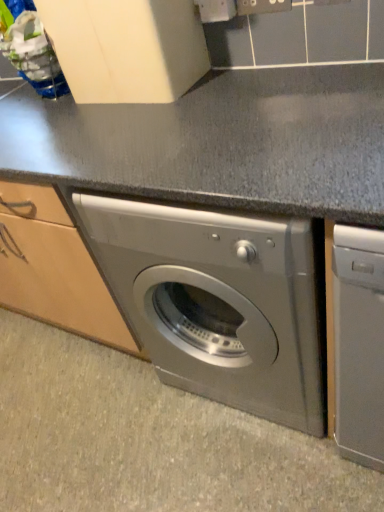
Describe the element at coordinates (220, 302) in the screenshot. I see `satin silver washing machine at center` at that location.

The height and width of the screenshot is (512, 384). I want to click on satin silver washing machine at center, so click(220, 302).

Find the location of `slate gray granite at center`. slate gray granite at center is located at coordinates (147, 439).

What do you see at coordinates (147, 439) in the screenshot?
I see `slate gray granite at center` at bounding box center [147, 439].

The width and height of the screenshot is (384, 512). What are the coordinates of `satin silver washing machine at center` in the screenshot? It's located at (220, 302).

Considering the positions of objects satin silver washing machine at center and slate gray granite at center in the image provided, who is more to the left, satin silver washing machine at center or slate gray granite at center?

slate gray granite at center.

Relative to slate gray granite at center, is satin silver washing machine at center in front or behind?

In the image, satin silver washing machine at center appears in front of slate gray granite at center.

Which is farther, (261, 398) or (77, 474)?

The point (77, 474) is farther from the camera.

From the image's perspective, is satin silver washing machine at center positioned above or below slate gray granite at center?

From the image's perspective, satin silver washing machine at center appears above slate gray granite at center.

From a real-world perspective, which is physically above, satin silver washing machine at center or slate gray granite at center?

satin silver washing machine at center is physically above.

Can you confirm if satin silver washing machine at center is thinner than slate gray granite at center?

Indeed, satin silver washing machine at center has a lesser width compared to slate gray granite at center.

Which of these two, satin silver washing machine at center or slate gray granite at center, stands shorter?

slate gray granite at center is shorter.

Is satin silver washing machine at center bigger than slate gray granite at center?

Correct, satin silver washing machine at center is larger in size than slate gray granite at center.

Do you think satin silver washing machine at center is within slate gray granite at center, or outside of it?

satin silver washing machine at center is spatially situated outside slate gray granite at center.

Would you say satin silver washing machine at center is a long distance from slate gray granite at center?

No, satin silver washing machine at center is not far away from slate gray granite at center.

In the scene shown: Could you tell me if satin silver washing machine at center is turned towards slate gray granite at center?

No, satin silver washing machine at center is not facing towards slate gray granite at center.

How different are the orientations of satin silver washing machine at center and slate gray granite at center in degrees?

0.00012 degrees separate the facing orientations of satin silver washing machine at center and slate gray granite at center.

Identify the location of granite that is on the left side of satin silver washing machine at center. (147, 439).

Does slate gray granite at center appear on the left side of satin silver washing machine at center?

Indeed, slate gray granite at center is positioned on the left side of satin silver washing machine at center.

Based on the photo, is the depth of slate gray granite at center less than that of satin silver washing machine at center?

No, slate gray granite at center is further to the viewer.

Is point (154, 406) positioned behind point (153, 359)?

Yes, it is.

From the image's perspective, is slate gray granite at center under satin silver washing machine at center?

Yes, from the image's perspective, slate gray granite at center is beneath satin silver washing machine at center.

From a real-world perspective, is slate gray granite at center on top of satin silver washing machine at center?

Incorrect, from a real-world perspective, slate gray granite at center is lower than satin silver washing machine at center.

Consider the image. Which of these two, slate gray granite at center or satin silver washing machine at center, is thinner?

With smaller width is satin silver washing machine at center.

Is slate gray granite at center taller or shorter than satin silver washing machine at center?

Considering their sizes, slate gray granite at center has less height than satin silver washing machine at center.

Which of these two, slate gray granite at center or satin silver washing machine at center, is smaller?

slate gray granite at center is smaller.

Is slate gray granite at center not inside satin silver washing machine at center?

slate gray granite at center lies outside satin silver washing machine at center's area.

Would you say slate gray granite at center is a long distance from satin silver washing machine at center?

No, slate gray granite at center is in close proximity to satin silver washing machine at center.

Is slate gray granite at center facing away from satin silver washing machine at center?

That's not correct — slate gray granite at center is not looking away from satin silver washing machine at center.

How different are the orientations of slate gray granite at center and satin silver washing machine at center in degrees?

The angle between the facing direction of slate gray granite at center and the facing direction of satin silver washing machine at center is 0.00012 degrees.

Measure the distance between slate gray granite at center and satin silver washing machine at center.

slate gray granite at center and satin silver washing machine at center are 15.69 inches apart from each other.

The image size is (384, 512). In order to click on granite that appears behind the satin silver washing machine at center in this screenshot , I will do `click(147, 439)`.

This screenshot has height=512, width=384. I want to click on granite on the left of satin silver washing machine at center, so click(x=147, y=439).

This screenshot has height=512, width=384. In order to click on granite that appears below the satin silver washing machine at center (from a real-world perspective) in this screenshot , I will do `click(147, 439)`.